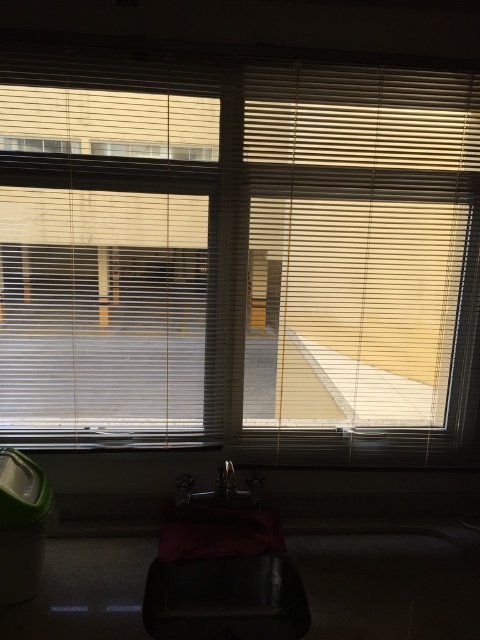
Question: Which is nearer to the transparent plastic window at upper left?

Choices:
 (A) matte white blinds at left
 (B) transparent plastic window at upper center
 (C) metallic sink at center
 (D) matte plastic blinds at center

Answer: (B)

Question: Among these points, which one is nearest to the camera?

Choices:
 (A) (23, 156)
 (B) (17, 262)
 (C) (156, 157)
 (D) (192, 481)

Answer: (A)

Question: Can you confirm if metallic sink at center is positioned below transparent plastic window at upper center?

Choices:
 (A) no
 (B) yes

Answer: (B)

Question: Which of the following is the farthest from the observer?

Choices:
 (A) matte white blinds at left
 (B) transparent plastic window at upper center
 (C) matte plastic blinds at center

Answer: (B)

Question: Can you confirm if matte plastic blinds at center is thinner than metallic sink at center?

Choices:
 (A) no
 (B) yes

Answer: (A)

Question: Does matte white blinds at left appear over metallic sink at center?

Choices:
 (A) yes
 (B) no

Answer: (A)